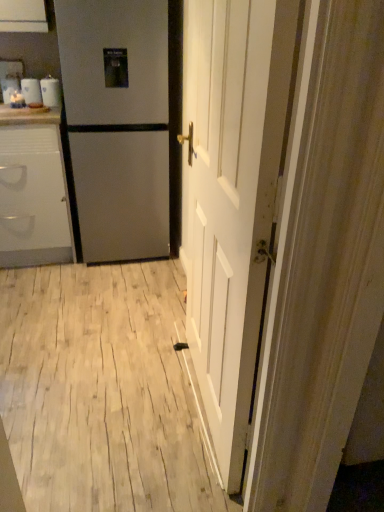
Find the location of a particular element. white wooden door at center is located at coordinates (232, 199).

The image size is (384, 512). I want to click on white wooden door at center, so click(232, 199).

I want to click on door in front of the white glossy cabinet at left, so click(232, 199).

Can you tell me how much white glossy cabinet at left and white wooden door at center differ in facing direction?

The angular difference between white glossy cabinet at left and white wooden door at center is 92.3 degrees.

Is white glossy cabinet at left inside the boundaries of white wooden door at center, or outside?

white glossy cabinet at left is outside white wooden door at center.

Can you confirm if white glossy cabinet at left is smaller than white wooden door at center?

No.

Does white wooden door at center turn towards white wood floor at center?

No, white wooden door at center is not facing towards white wood floor at center.

Are white wooden door at center and white wood floor at center far apart?

No, white wooden door at center is not far away from white wood floor at center.

From a real-world perspective, is white wooden door at center physically located above or below white wood floor at center?

From a real-world perspective, white wooden door at center is physically above white wood floor at center.

From the image's perspective, is white wood floor at center below white glossy counter top at upper left?

Yes, from the image's perspective, white wood floor at center is below white glossy counter top at upper left.

How far apart are white wood floor at center and white glossy counter top at upper left?

white wood floor at center and white glossy counter top at upper left are 1.29 meters apart.

Based on the photo, is the depth of white wood floor at center less than that of white glossy counter top at upper left?

Yes, it is in front of white glossy counter top at upper left.

Where is `plywood that appears below the white glossy counter top at upper left (from a real-world perspective)`? This screenshot has height=512, width=384. plywood that appears below the white glossy counter top at upper left (from a real-world perspective) is located at coordinates (101, 391).

Is white glossy mugs at upper left at the right side of satin silver refrigerator at left?

No.

Is satin silver refrigerator at left at the back of white glossy mugs at upper left?

white glossy mugs at upper left does not have its back to satin silver refrigerator at left.

Looking at this image, measure the distance between white glossy mugs at upper left and satin silver refrigerator at left.

white glossy mugs at upper left and satin silver refrigerator at left are 17.14 inches apart.

From a real-world perspective, which object stands above the other?

white glossy mugs at upper left.

Are white glossy counter top at upper left and white glossy mugs at upper left located far from each other?

Actually, white glossy counter top at upper left and white glossy mugs at upper left are a little close together.

Looking at this image, which object is thinner, white glossy counter top at upper left or white glossy mugs at upper left?

white glossy mugs at upper left is thinner.

Which is in front, white glossy counter top at upper left or white glossy mugs at upper left?

white glossy counter top at upper left.

Is white glossy mugs at upper left completely or partially inside white glossy counter top at upper left?

No.

How far apart are white wood floor at center and white wooden door at center?

white wood floor at center and white wooden door at center are 68.99 centimeters apart from each other.

Who is taller, white wood floor at center or white wooden door at center?

With more height is white wooden door at center.

Does white wood floor at center have a lesser width compared to white wooden door at center?

No, white wood floor at center is not thinner than white wooden door at center.

You are a GUI agent. You are given a task and a screenshot of the screen. Output one action in this format:
    pyautogui.click(x=<x>, y=<y>)
    Task: Click on the plywood that appears below the white wooden door at center (from a real-world perspective)
    
    Given the screenshot: What is the action you would take?
    pyautogui.click(x=101, y=391)

Is white glossy mugs at upper left positioned beyond the bounds of white glossy cabinet at left?

Absolutely, white glossy mugs at upper left is external to white glossy cabinet at left.

Between white glossy mugs at upper left and white glossy cabinet at left, which one is positioned behind?

white glossy mugs at upper left is more distant.

Is white glossy mugs at upper left wider or thinner than white glossy cabinet at left?

Considering their sizes, white glossy mugs at upper left looks slimmer than white glossy cabinet at left.

Are white glossy mugs at upper left and white glossy cabinet at left making contact?

No, white glossy mugs at upper left is not beside white glossy cabinet at left.

In order to click on cabinetry above the white wooden door at center (from the image's perspective) in this screenshot , I will do `click(33, 190)`.

The width and height of the screenshot is (384, 512). What are the coordinates of `plywood lying below the white wooden door at center (from the image's perspective)` in the screenshot? It's located at (101, 391).

From the image, which object appears to be farther from white glossy cabinet at left, white wood floor at center or white glossy mugs at upper left?

The object further to white glossy cabinet at left is white wood floor at center.

Consider the image. Considering their positions, is white wooden door at center positioned closer to white wood floor at center than satin silver refrigerator at left?

white wooden door at center is positioned closer to the anchor white wood floor at center.

Based on their spatial positions, is white wood floor at center or white glossy counter top at upper left closer to white glossy cabinet at left?

white glossy counter top at upper left is closer to white glossy cabinet at left.

When comparing their distances from white wood floor at center, does white wooden door at center or white glossy cabinet at left seem further?

Among the two, white glossy cabinet at left is located further to white wood floor at center.

Estimate the real-world distances between objects in this image. Which object is further from white glossy counter top at upper left, white wood floor at center or white glossy cabinet at left?

Among the two, white wood floor at center is located further to white glossy counter top at upper left.

From the image, which object appears to be farther from satin silver refrigerator at left, white glossy mugs at upper left or white glossy counter top at upper left?

Among the two, white glossy mugs at upper left is located further to satin silver refrigerator at left.

When comparing their distances from satin silver refrigerator at left, does white wooden door at center or white glossy cabinet at left seem closer?

Based on the image, white glossy cabinet at left appears to be nearer to satin silver refrigerator at left.

Looking at the image, which one is located closer to white wood floor at center, white wooden door at center or white glossy counter top at upper left?

white wooden door at center.

Find the location of `cabinetry between white wood floor at center and white glossy mugs at upper left in the front-back direction`. cabinetry between white wood floor at center and white glossy mugs at upper left in the front-back direction is located at coordinates (33, 190).

The height and width of the screenshot is (512, 384). Identify the location of appliance located between white glossy cabinet at left and satin silver refrigerator at left in the left-right direction. (51, 92).

Locate an element on the screen. plywood between white wooden door at center and white glossy mugs at upper left from front to back is located at coordinates (101, 391).

The width and height of the screenshot is (384, 512). Find the location of `refrigerator between white glossy mugs at upper left and white wood floor at center in the vertical direction`. refrigerator between white glossy mugs at upper left and white wood floor at center in the vertical direction is located at coordinates (117, 124).